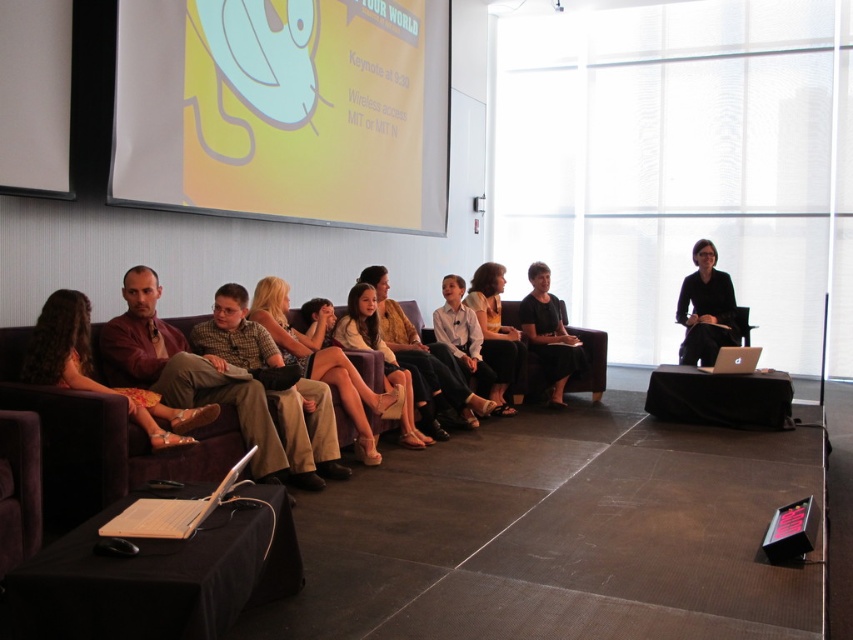
Question: Among these objects, which one is nearest to the camera?

Choices:
 (A) black satin dress at center
 (B) matte beige dress at center
 (C) yellow matte projection screen at upper left

Answer: (C)

Question: In this image, where is light beige fabric couch at center located relative to white shirt at center?

Choices:
 (A) below
 (B) above

Answer: (A)

Question: Where is light beige fabric couch at center located in relation to white shirt at center in the image?

Choices:
 (A) below
 (B) above

Answer: (A)

Question: Which object is positioned closest to the wooden laptop at lower left?

Choices:
 (A) black fabric chair at right
 (B) matte beige dress at center
 (C) matte brown pants at center

Answer: (C)

Question: Does black fabric chair at right appear under white shirt at center?

Choices:
 (A) no
 (B) yes

Answer: (A)

Question: Which object is closer to the camera taking this photo?

Choices:
 (A) black fabric chair at right
 (B) matte brown leather couch at left
 (C) wooden laptop at lower left

Answer: (C)